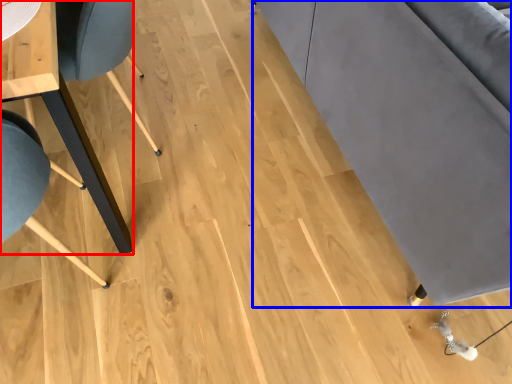
Question: Which of the following is the farthest to the observer, table (highlighted by a red box) or couch (highlighted by a blue box)?

Choices:
 (A) table
 (B) couch

Answer: (A)